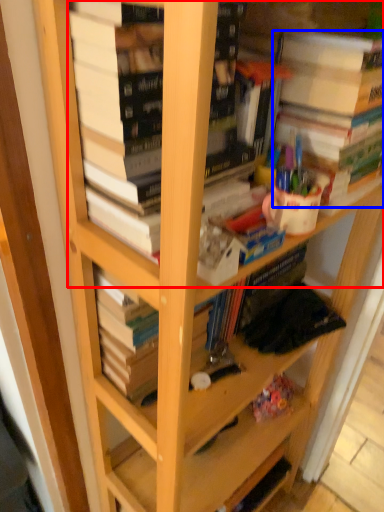
Question: Among these objects, which one is farthest to the camera, book (highlighted by a red box) or book (highlighted by a blue box)?

Choices:
 (A) book
 (B) book

Answer: (B)